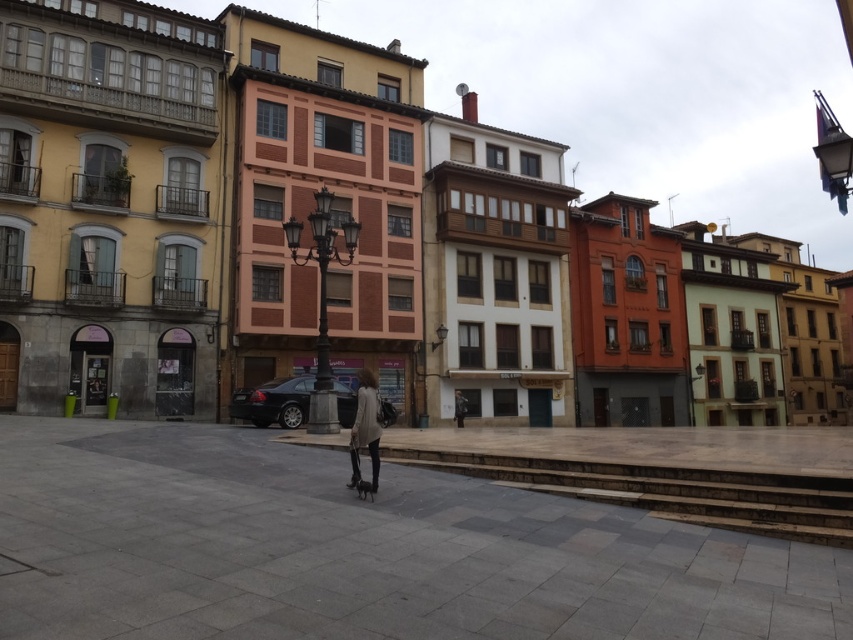
You are a fashion designer observing two people in the plaza. You notice the light beige sweater at center and the dark gray fabric jacket at center. Which clothing item is taller?

The light beige sweater at center is taller than the dark gray fabric jacket at center.

Consider the image. You are standing in the plaza and see the point marked at coordinates (364, 428). What object is located at that point?

The point at coordinates (364, 428) corresponds to the light beige sweater at center.